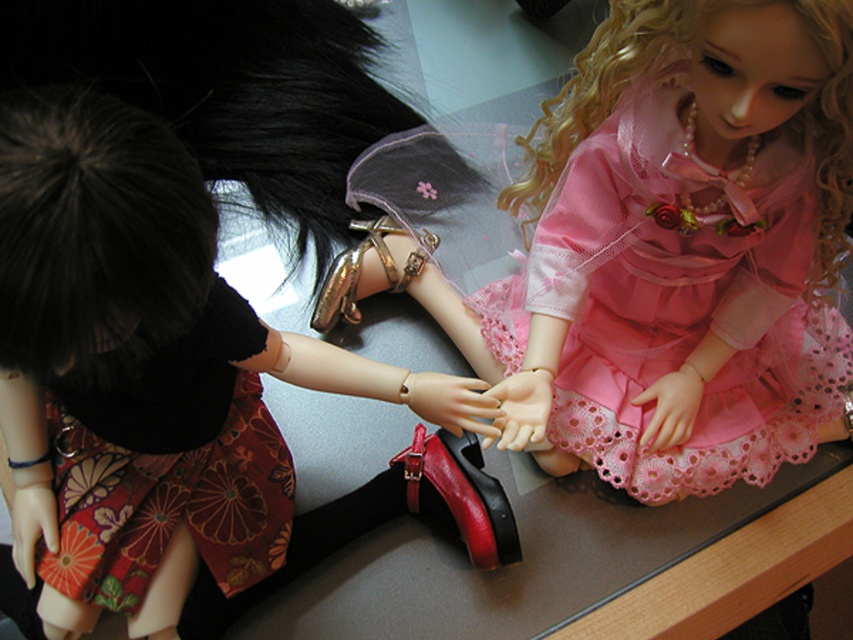
Question: Does matte black doll at center appear under pink lace dress at upper right?

Choices:
 (A) yes
 (B) no

Answer: (A)

Question: Which point is closer to the camera taking this photo?

Choices:
 (A) (54, 432)
 (B) (492, 541)

Answer: (A)

Question: Is floral silk skirt at lower left further to camera compared to shiny red leather shoe at center?

Choices:
 (A) yes
 (B) no

Answer: (B)

Question: Which object appears farthest from the camera in this image?

Choices:
 (A) pink lace dress at upper right
 (B) shiny red leather shoe at center

Answer: (B)

Question: Which object appears farthest from the camera in this image?

Choices:
 (A) floral silk skirt at lower left
 (B) matte black doll at center
 (C) pink lace dress at upper right
 (D) shiny red leather shoe at center

Answer: (D)

Question: Does matte black doll at center have a greater width compared to floral silk skirt at lower left?

Choices:
 (A) yes
 (B) no

Answer: (A)